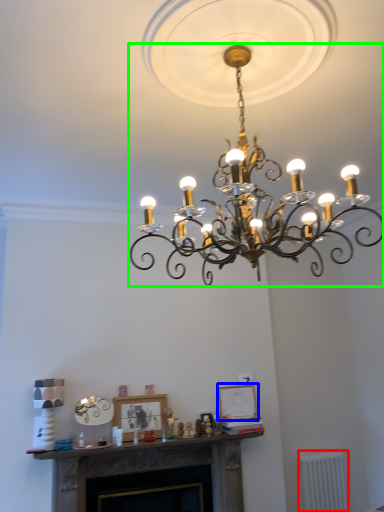
Question: Which object is positioned closest to radiator (highlighted by a red box)? Select from picture frame (highlighted by a blue box) and lamp (highlighted by a green box).

Choices:
 (A) picture frame
 (B) lamp

Answer: (A)